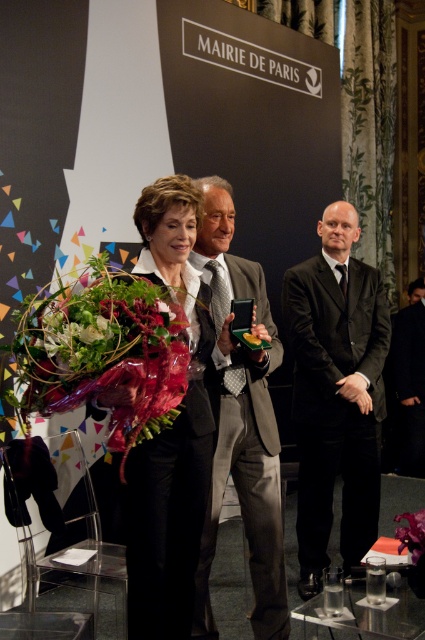
You are a photographer at the Mairie de Paris event. You need to capture a photo where both the black suit at center and the green leafy bouquet at center are clearly visible. Based on their positions, which object should you focus on first to ensure both are in frame?

The black suit at center is located below the green leafy bouquet at center. To ensure both are in frame, focus on the green leafy bouquet at center first since it is higher up, then adjust to include the black suit at center below it.

You are an event planner organizing a ceremony at the Mairie de Paris. You need to ensure that the gray suit at center and the green leafy bouquet at center can fit on a 1.2 meter wide table. Given their sizes, will both items fit comfortably on the table?

The gray suit at center is wider than the green leafy bouquet at center. However, without specific measurements, it is impossible to determine if both will fit on the 1.2 meter wide table. More information about their exact dimensions is needed.